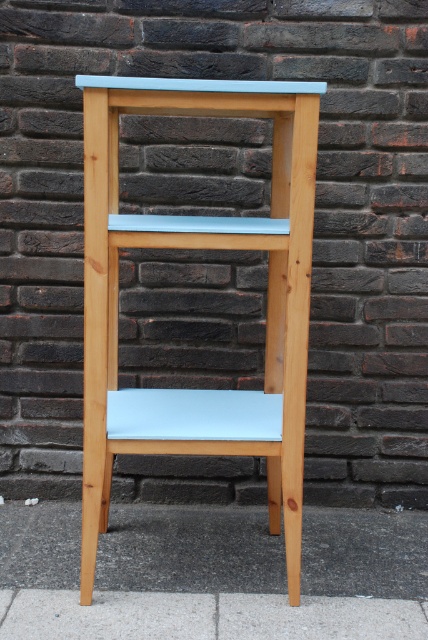
You are trying to place a new table next to the light blue matte wood chair at center. The table requires a space wider than the chair. Can the gray concrete pavement at lower center provide enough space for the table?

The light blue matte wood chair at center has a width less than the gray concrete pavement at lower center. Therefore, the gray concrete pavement at lower center can provide enough space for the table since it is wider than the chair.

You are standing in a room with the wooden three tiered shelf unit against the dark brick wall. You see a light blue matte wood chair at center and a gray concrete pavement at lower center. Which object is positioned to the left of the other?

The light blue matte wood chair at center is to the left of gray concrete pavement at lower center.